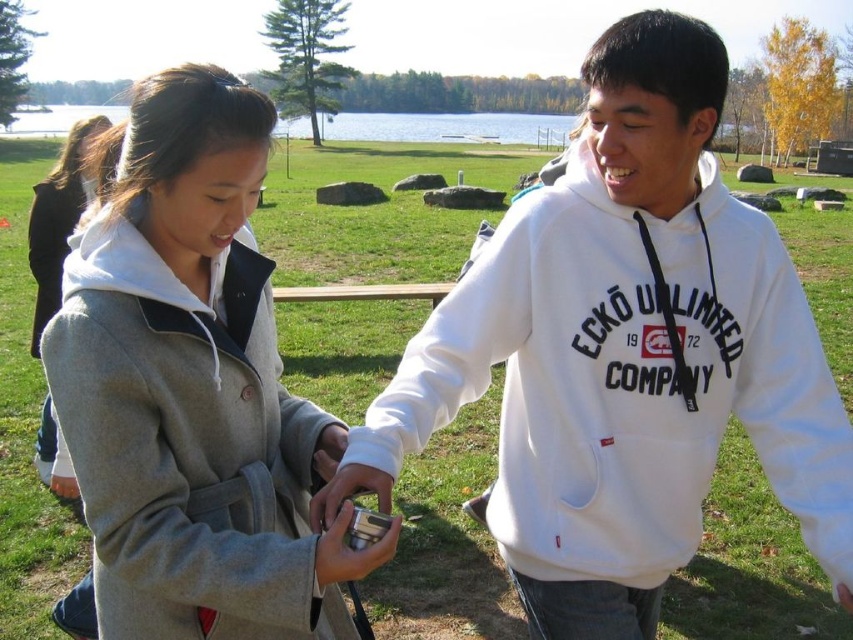
Question: Which of the following is the closest to the observer?

Choices:
 (A) [x=590, y=168]
 (B) [x=343, y=532]
 (C) [x=49, y=216]
 (D) [x=157, y=230]

Answer: (B)

Question: Which object is closer to the camera taking this photo?

Choices:
 (A) white fleece hoodie at center
 (B) light gray wool coat at center
 (C) gray wool coat at center
 (D) metallic silver camera at center

Answer: (D)

Question: Can you confirm if white fleece hoodie at center is positioned to the right of light gray wool coat at center?

Choices:
 (A) yes
 (B) no

Answer: (A)

Question: Does white fleece hoodie at center appear under light gray wool coat at center?

Choices:
 (A) yes
 (B) no

Answer: (A)

Question: Which point is farther to the camera?

Choices:
 (A) white fleece hoodie at center
 (B) light gray wool coat at center
 (C) metallic silver camera at center
 (D) gray wool coat at center

Answer: (B)

Question: Can you confirm if gray wool coat at center is wider than metallic silver camera at center?

Choices:
 (A) yes
 (B) no

Answer: (A)